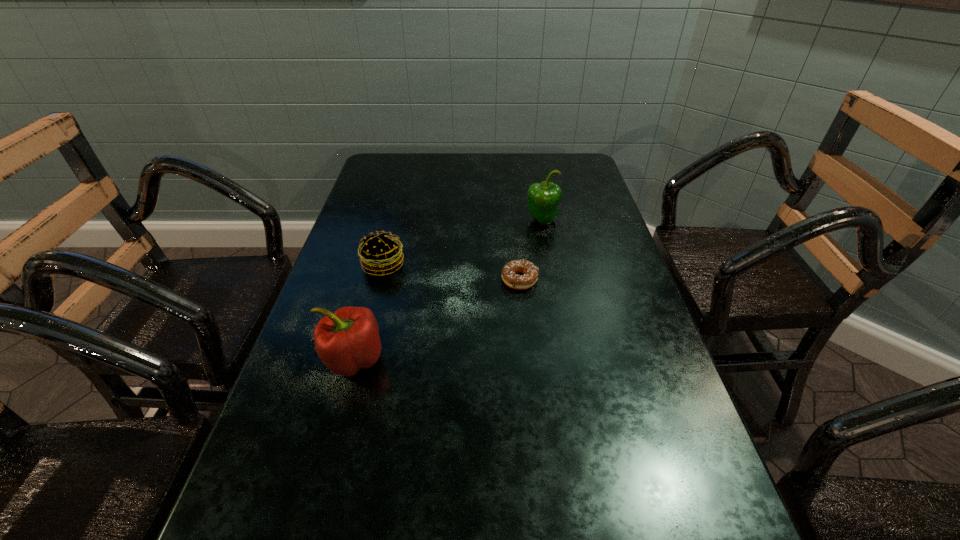
This screenshot has width=960, height=540. What are the coordinates of `bell pepper that is at the left edge` in the screenshot? It's located at (347, 340).

At what (x,y) coordinates should I click in order to perform the action: click on patty at the left edge. Please return your answer as a coordinate pair (x, y). Looking at the image, I should click on (381, 253).

Where is `object that is at the right edge`? The height and width of the screenshot is (540, 960). object that is at the right edge is located at coordinates (543, 199).

The height and width of the screenshot is (540, 960). In the image, there is a desktop. In order to click on vacant space at the far edge in this screenshot , I will do `click(501, 160)`.

Find the location of a particular element. free space at the left edge is located at coordinates (325, 528).

Identify the location of vacant space at the right edge of the desktop. click(630, 495).

This screenshot has height=540, width=960. I want to click on vacant region at the far left corner of the desktop, so click(407, 174).

I want to click on vacant space at the far right corner, so tap(557, 160).

You are a GUI agent. You are given a task and a screenshot of the screen. Output one action in this format:
    pyautogui.click(x=<x>, y=<y>)
    Task: Click on the unoccupied position between the tallest object and the second shortest object
    The width and height of the screenshot is (960, 540).
    Given the screenshot: What is the action you would take?
    pyautogui.click(x=463, y=243)

Locate an element on the screen. vacant area between the shorter bell pepper and the taller bell pepper is located at coordinates (447, 290).